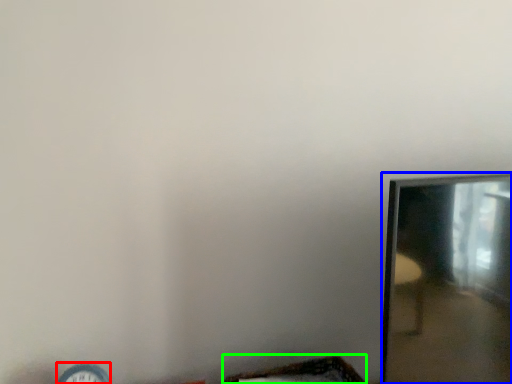
Question: Estimate the real-world distances between objects in this image. Which object is closer to clock (highlighted by a red box), mirror (highlighted by a blue box) or basket (highlighted by a green box)?

Choices:
 (A) mirror
 (B) basket

Answer: (B)